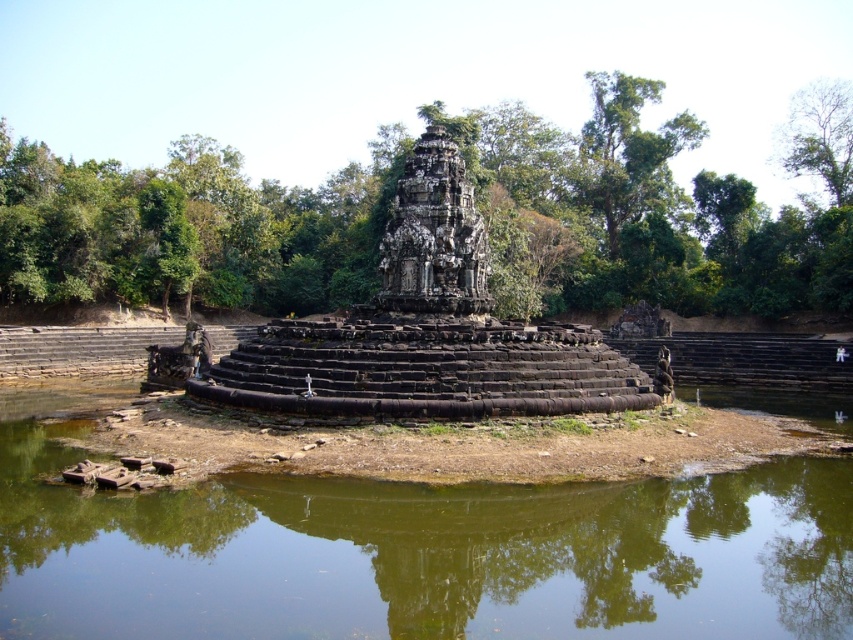
Does greenish-brown water at center have a lesser width compared to dark gray stone ruins at center?

No.

Can you confirm if greenish-brown water at center is bigger than dark gray stone ruins at center?

No.

Describe the element at coordinates (418, 552) in the screenshot. I see `greenish-brown water at center` at that location.

Locate an element on the screen. Image resolution: width=853 pixels, height=640 pixels. greenish-brown water at center is located at coordinates (418, 552).

Can you confirm if greenish-brown water at center is thinner than dark gray stone temple at center?

Incorrect, greenish-brown water at center's width is not less than dark gray stone temple at center's.

Does point (821, 621) come farther from viewer compared to point (440, 260)?

No, (821, 621) is closer to viewer.

Is point (650, 509) positioned before point (453, 289)?

Yes, point (650, 509) is in front of point (453, 289).

Where is `greenish-brown water at center`? This screenshot has height=640, width=853. greenish-brown water at center is located at coordinates (418, 552).

Which is in front, point (405, 189) or point (846, 106)?

Point (405, 189) is in front.

Which is below, dark gray stone temple at center or green leafy tree at upper right?

dark gray stone temple at center is below.

Is point (409, 305) positioned behind point (793, 129)?

No.

At what (x,y) coordinates should I click in order to perform the action: click on dark gray stone temple at center. Please return your answer as a coordinate pair (x, y). The height and width of the screenshot is (640, 853). Looking at the image, I should click on (433, 237).